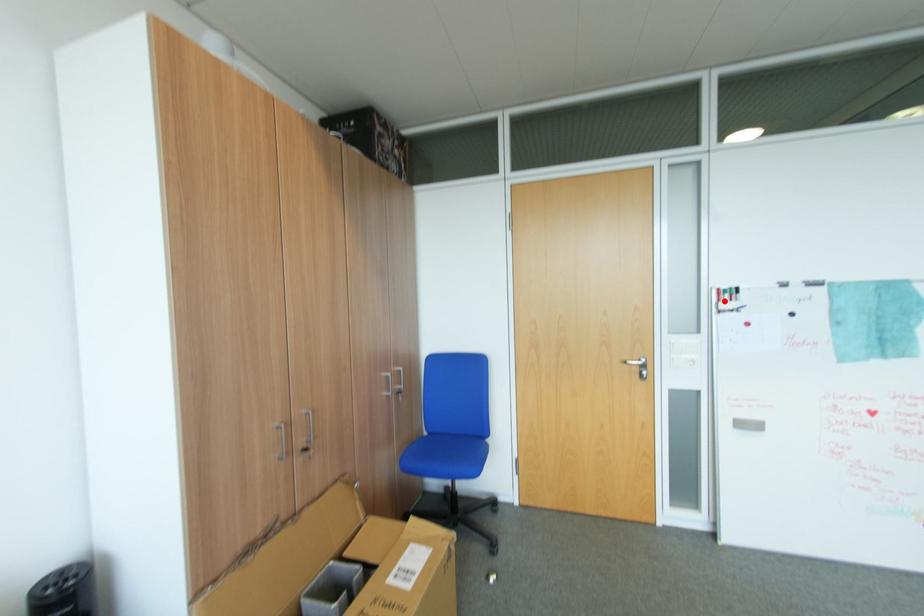
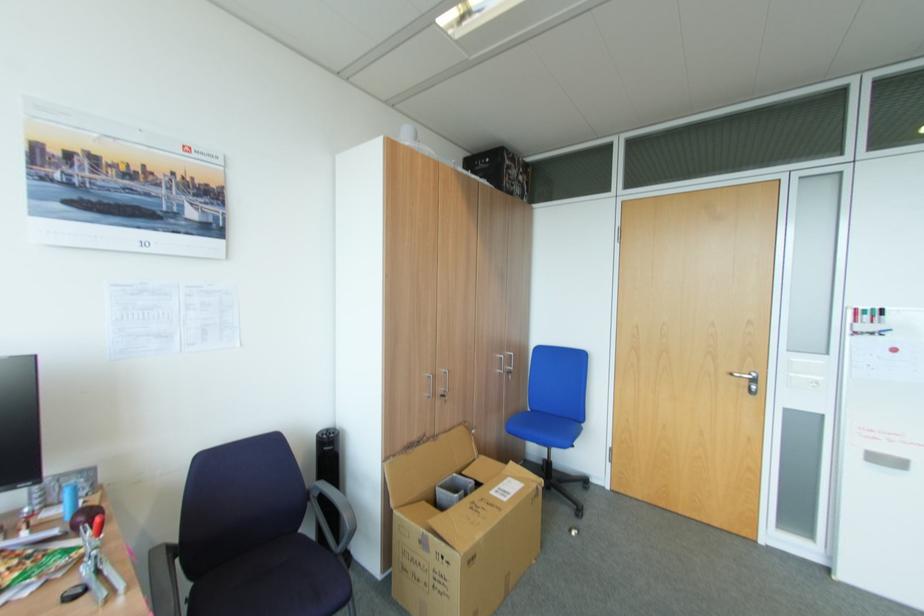
In the second image, find the point that corresponds to the highlighted location in the first image.

(861, 322)